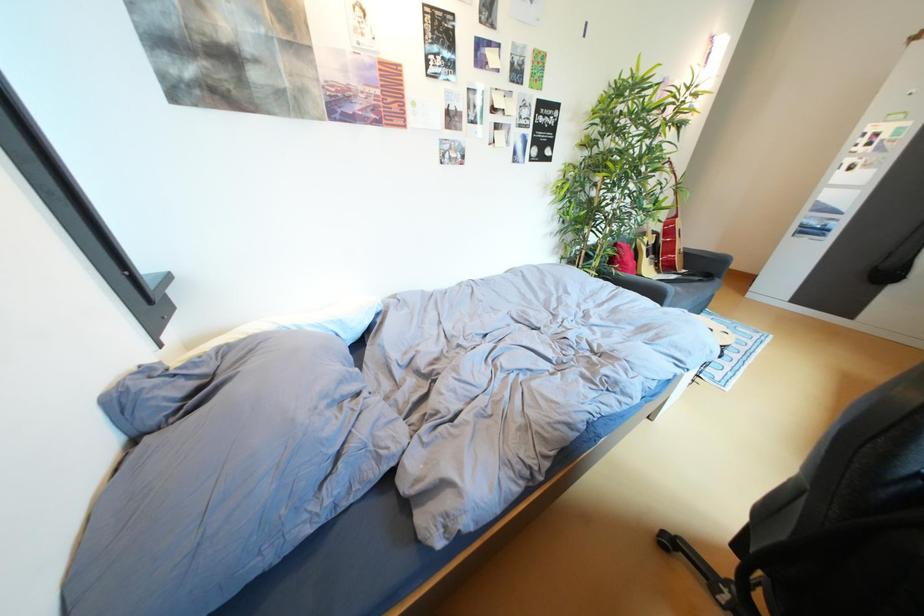
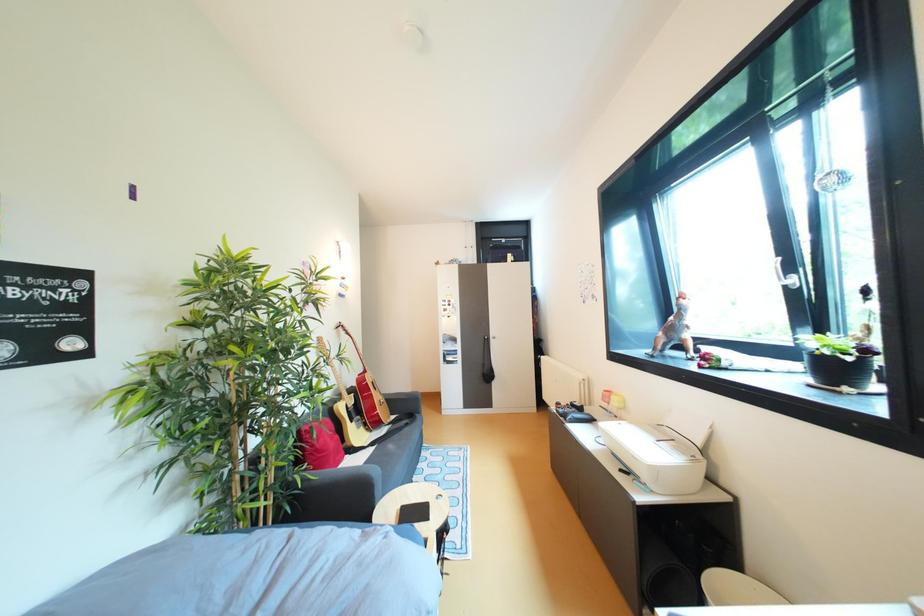
First-person continuous shooting, in which direction is the camera rotating?

The rotation direction of the camera is right-up.